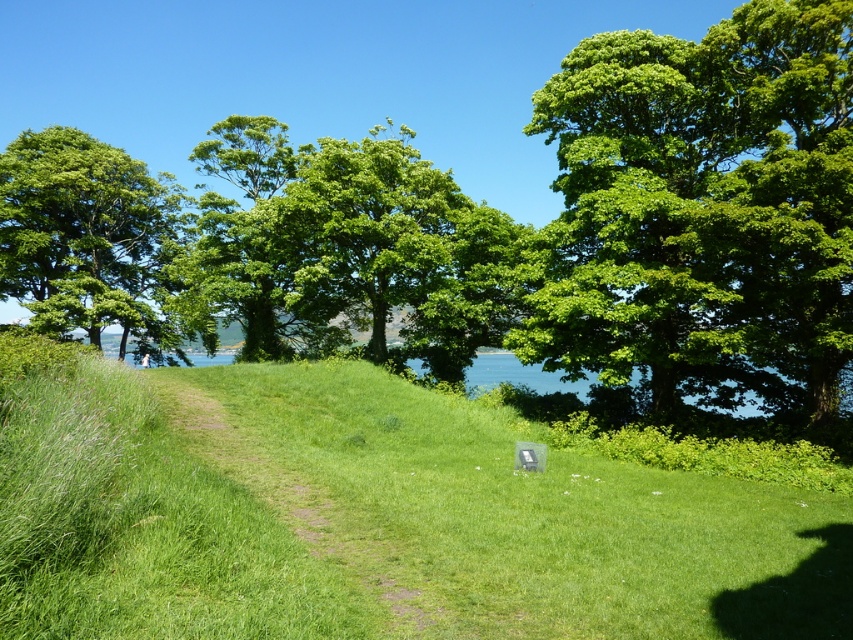
Between green leafy tree at upper center and green leafy tree at center, which one is positioned lower?

green leafy tree at upper center

Who is taller, green leafy tree at upper center or green leafy tree at center?

Standing taller between the two is green leafy tree at center.

The height and width of the screenshot is (640, 853). I want to click on green leafy tree at upper center, so click(x=703, y=211).

Does green grassy trail at center appear on the left side of green leafy tree at center?

In fact, green grassy trail at center is to the right of green leafy tree at center.

Between point (263, 541) and point (238, 136), which one is positioned behind?

Point (238, 136)

At what (x,y) coordinates should I click in order to perform the action: click on green grassy trail at center. Please return your answer as a coordinate pair (x, y). Looking at the image, I should click on (321, 474).

Is green leafy tree at upper center to the left of green leafy tree at left from the viewer's perspective?

Incorrect, green leafy tree at upper center is not on the left side of green leafy tree at left.

Which is more to the right, green leafy tree at upper center or green leafy tree at left?

green leafy tree at upper center is more to the right.

Which is behind, point (822, 404) or point (102, 182)?

Positioned behind is point (102, 182).

Identify the location of green leafy tree at upper center. (703, 211).